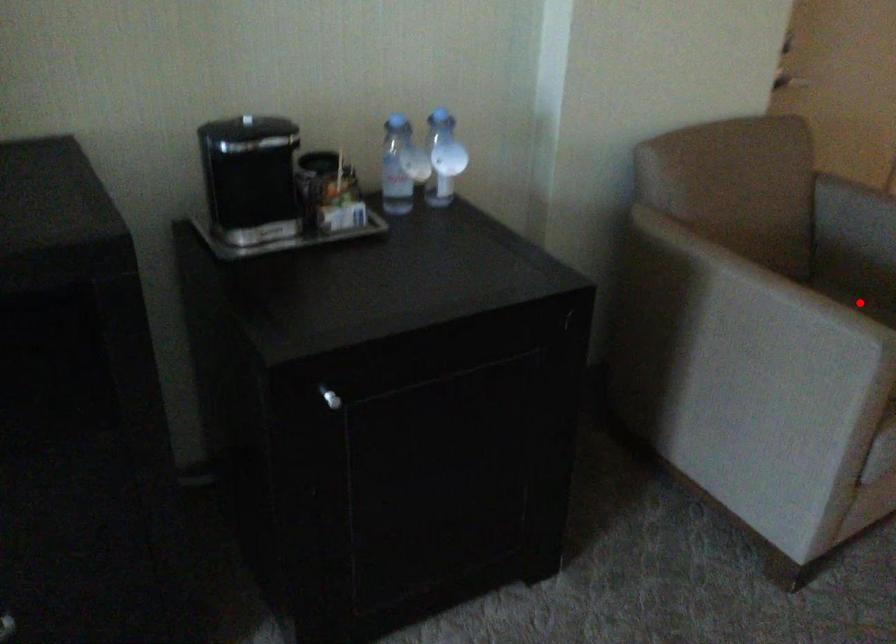
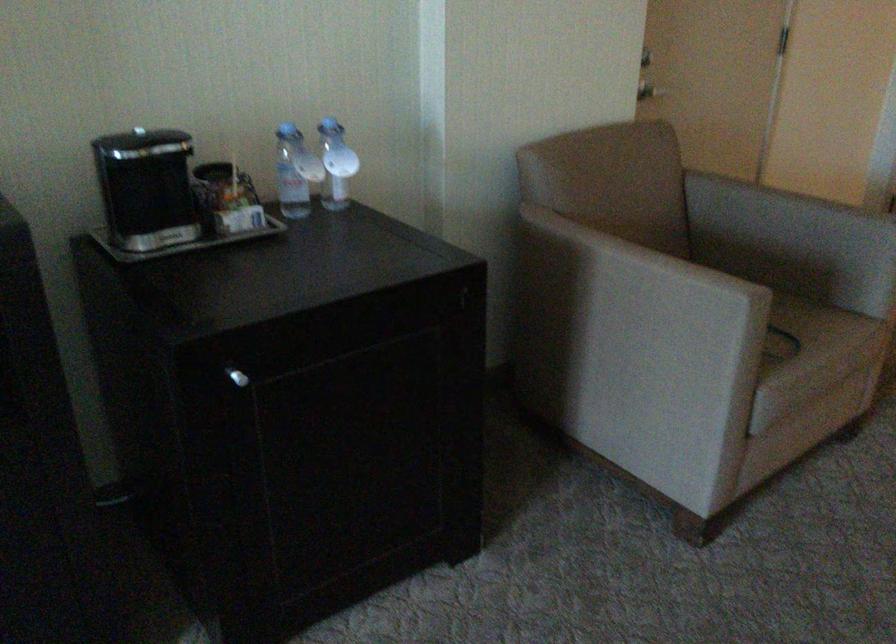
Question: I am providing you with two images of the same scene from different viewpoints. In image1, a red point is highlighted. Considering the same 3D point in image2, which of the following is correct?

Choices:
 (A) It is closer
 (B) It is farther

Answer: (A)